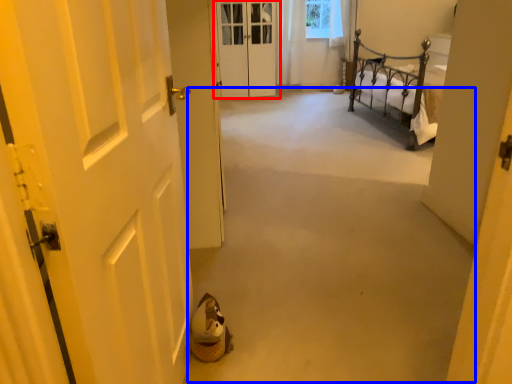
Question: Which of the following is the closest to the observer, door (highlighted by a red box) or corridor (highlighted by a blue box)?

Choices:
 (A) door
 (B) corridor

Answer: (B)